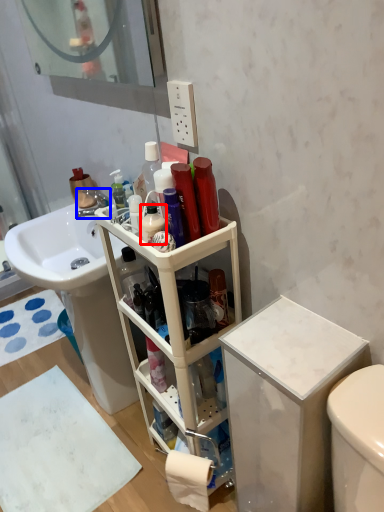
Question: Which object appears farthest to the camera in this image, cleaning product (highlighted by a red box) or faucet (highlighted by a blue box)?

Choices:
 (A) cleaning product
 (B) faucet

Answer: (B)